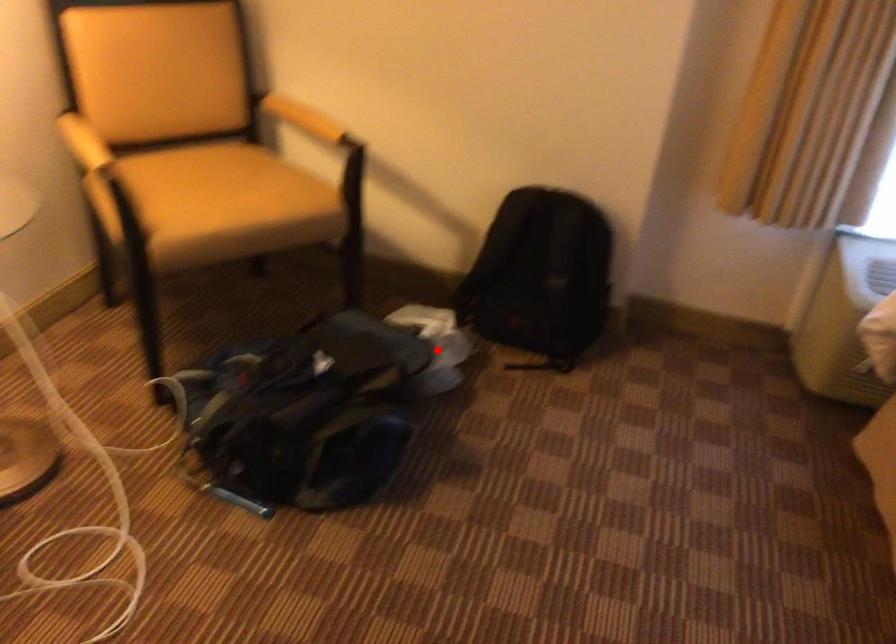
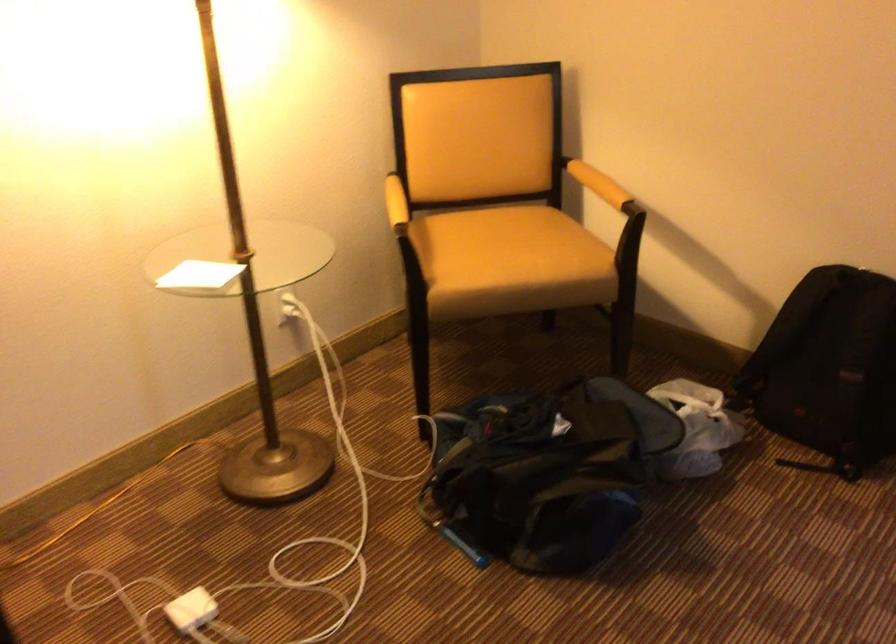
Find the pixel in the second image that matches the highlighted location in the first image.

(696, 428)